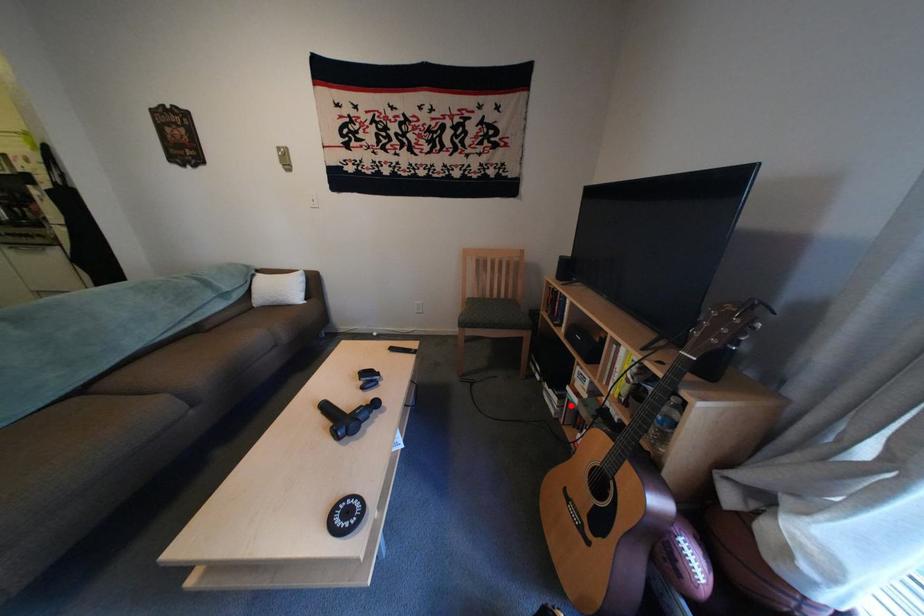
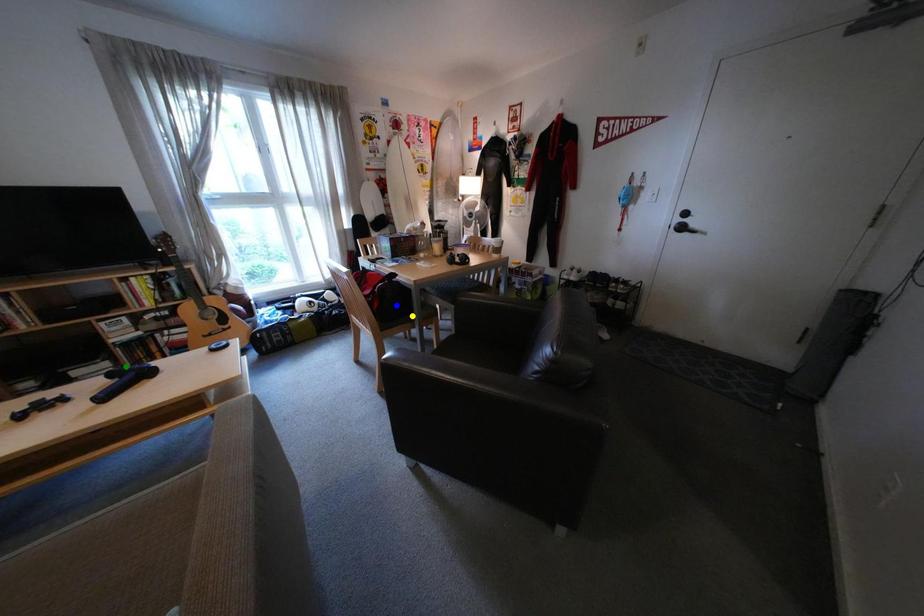
Question: I am providing you with two images of the same scene from different viewpoints. A red point is marked on the first image. You are given multiple points on the second image. Which spot in image 2 lines up with the point in image 1?

Choices:
 (A) yellow point
 (B) green point
 (C) blue point

Answer: (B)